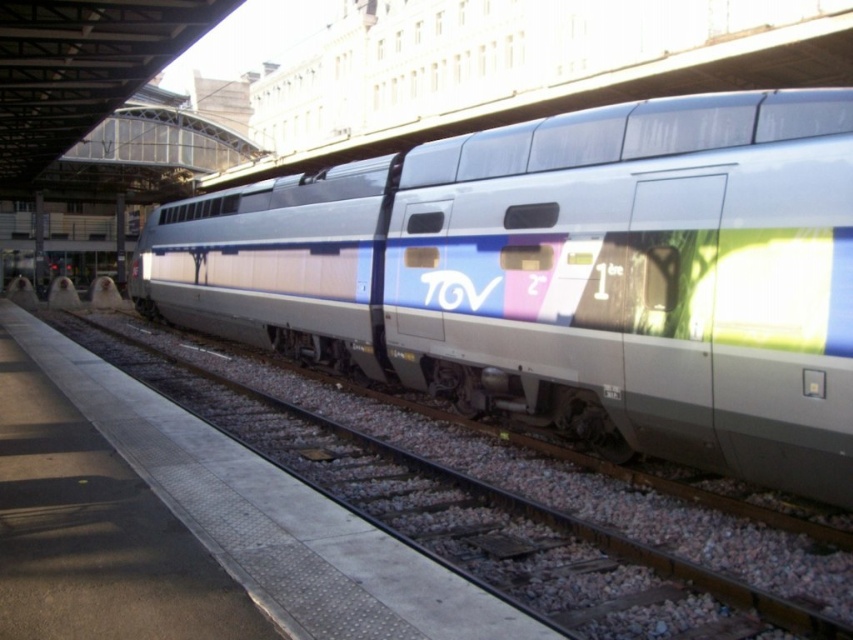
You are standing on the platform at the train station. You see a point marked at coordinates (566,276). What object is located at this point?

The point at coordinates (566,276) indicates the silver metallic train at center.